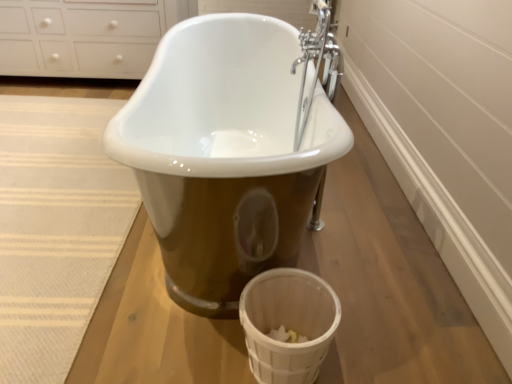
Locate an element on the screen. Image resolution: width=512 pixels, height=384 pixels. free spot in front of white glossy cabinet at upper left is located at coordinates (60, 118).